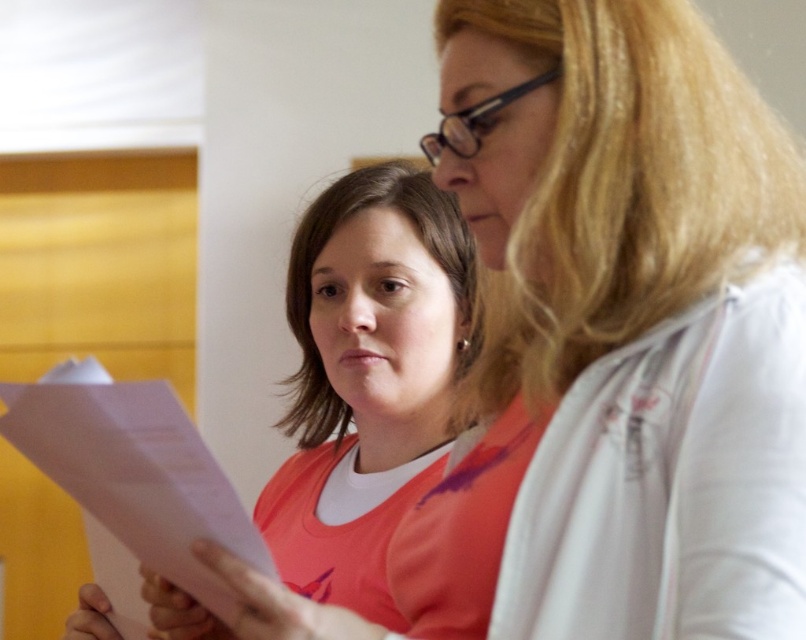
You are a delivery robot with a 0.5 meter wide package. You need to navigate between the two people to reach the door behind them. The pink matte paper at center is between them. Can you fit through the space between them?

The two people are 1.09 meters apart, so the delivery robot with a 0.5 meter wide package can fit through the space between them since the distance is wider than the package.

You are organizing a meeting and need to place two pink papers on the table. The pink matte paper at center and the pink paper at lower left are available. Which one should you choose if you need a larger surface area for notes?

The pink matte paper at center is bigger than the pink paper at lower left, so you should choose the pink matte paper at center for a larger surface area.

You are organizing documents on a desk and need to place both the pink matte paper at center and the pink paper at lower left side by side. Which one should you place first to ensure they fit without overlapping?

The pink paper at lower left is narrower, so place it first to leave space for the wider pink matte paper at center.